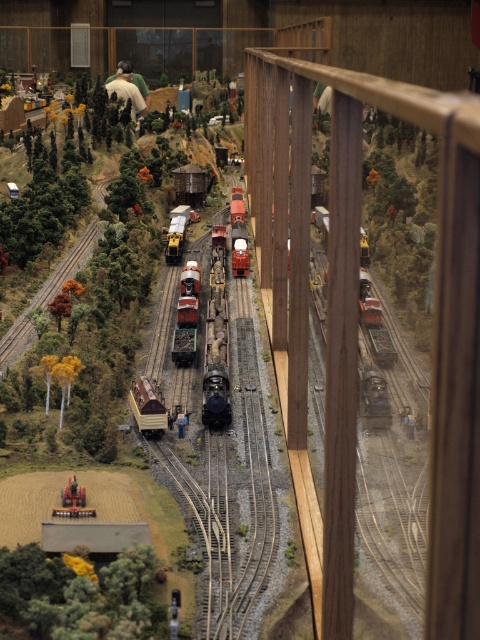
In the scene shown: Does shiny silver train at center have a larger size compared to metallic red train car at center?

Indeed, shiny silver train at center has a larger size compared to metallic red train car at center.

Can you confirm if shiny silver train at center is positioned to the left of metallic red train car at center?

Incorrect, shiny silver train at center is not on the left side of metallic red train car at center.

Image resolution: width=480 pixels, height=640 pixels. What are the coordinates of `shiny silver train at center` in the screenshot? It's located at (216, 348).

Can you confirm if metallic red train car at center is taller than matte brown wooden train car at center?

Yes, metallic red train car at center is taller than matte brown wooden train car at center.

Does point (181, 326) come farther from viewer compared to point (132, 403)?

Yes, it is.

Is point (190, 346) more distant than point (158, 413)?

Yes, point (190, 346) is farther from viewer.

Identify the location of metallic red train car at center. The height and width of the screenshot is (640, 480). (187, 316).

Is shiny silver train at center below matte red train at center?

Correct, shiny silver train at center is located below matte red train at center.

Based on the photo, who is more forward, (210, 332) or (247, 268)?

Positioned in front is point (210, 332).

Measure the distance between shiny silver train at center and camera.

The distance of shiny silver train at center from camera is 1.45 meters.

This screenshot has width=480, height=640. What are the coordinates of `shiny silver train at center` in the screenshot? It's located at (216, 348).